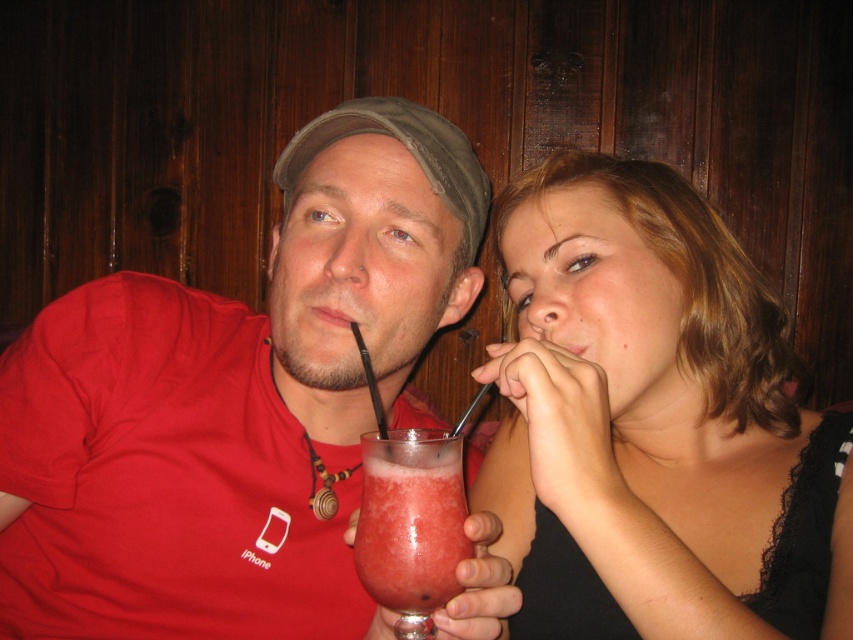
You are a photographer adjusting the focus on your camera. You want to capture both the matte red shirt at center and the smoothie glass at center in sharp focus. Given that your camera can only focus on objects within a 5 inch range, will both objects be in focus?

The matte red shirt at center is 7.13 inches away from the smoothie glass at center. Since the distance between them exceeds the camera focus range of 5 inches, only one of them can be in focus at a time.

You are a photographer setting up a shoot in the scene described. You need to adjust the lighting so that the matte black drink at center is visible without being obscured by the matte red shirt at center. What adjustment should you make?

The matte black drink at center is behind the matte red shirt at center, so to make it visible, you should adjust the lighting to highlight the matte black drink at center or move the matte red shirt at center slightly forward to create space between them.